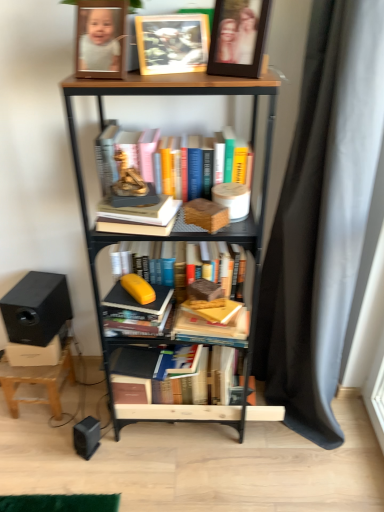
At what (x,y) coordinates should I click in order to perform the action: click on free point behind black plastic speaker at lower left, the first speaker in the right-to-left sequence. Please return your answer as a coordinate pair (x, y). This screenshot has height=512, width=384. Looking at the image, I should click on (93, 413).